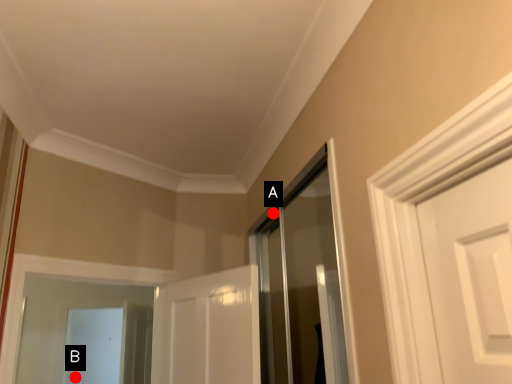
Question: Two points are circled on the image, labeled by A and B beside each circle. Among these points, which one is farthest from the camera?

Choices:
 (A) A is further
 (B) B is further

Answer: (B)